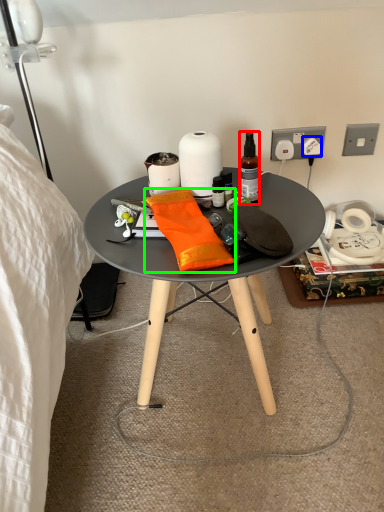
Question: Which is farther away from bottle (highlighted by a red box)? power outlet (highlighted by a blue box) or material (highlighted by a green box)?

Choices:
 (A) power outlet
 (B) material

Answer: (A)